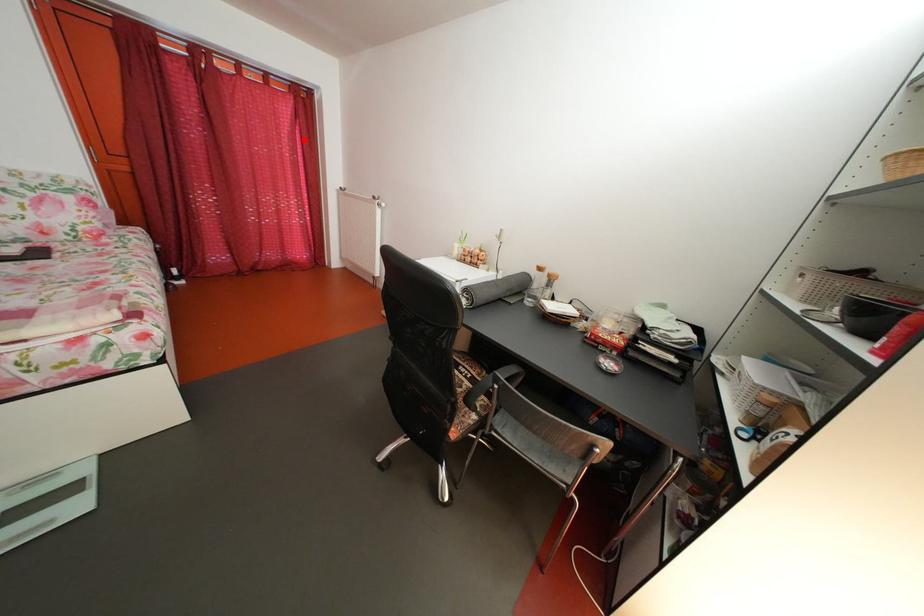
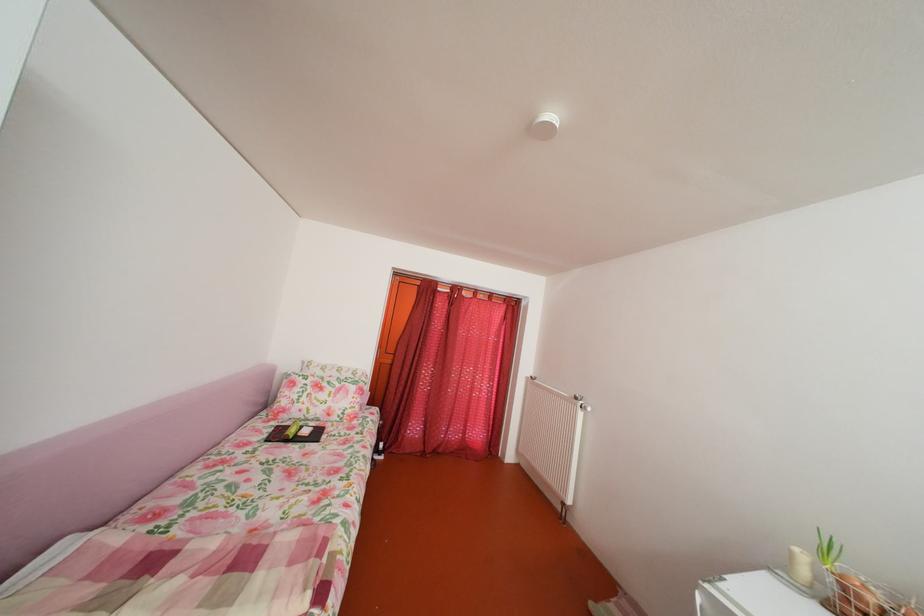
Question: I am providing you with two images of the same scene from different viewpoints. Image1 has a red point marked. In image2, the corresponding 3D location appears at what relative position? Reply with the corresponding letter.

Choices:
 (A) Closer
 (B) Farther

Answer: (B)